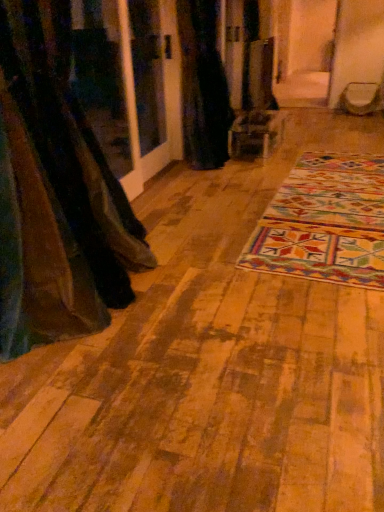
Question: Does multicolored woven mat at center have a lesser height compared to brown fabric curtain at left, the 1th curtain viewed from the front?

Choices:
 (A) yes
 (B) no

Answer: (A)

Question: Is brown fabric curtain at left, the 1th curtain viewed from the front, inside multicolored woven mat at center?

Choices:
 (A) yes
 (B) no

Answer: (B)

Question: Would you say multicolored woven mat at center is a long distance from brown fabric curtain at left, acting as the first curtain starting from the bottom?

Choices:
 (A) yes
 (B) no

Answer: (A)

Question: Is the depth of multicolored woven mat at center greater than that of brown fabric curtain at left, which is counted as the 1th curtain, starting from the left?

Choices:
 (A) yes
 (B) no

Answer: (A)

Question: Would you say multicolored woven mat at center is outside brown fabric curtain at left, which is counted as the 1th curtain, starting from the left?

Choices:
 (A) yes
 (B) no

Answer: (A)

Question: Is multicolored woven mat at center situated inside brown fabric curtain at left, which appears as the second curtain when viewed from the right, or outside?

Choices:
 (A) outside
 (B) inside

Answer: (A)

Question: Based on their sizes in the image, would you say multicolored woven mat at center is bigger or smaller than brown fabric curtain at left, acting as the second curtain starting from the back?

Choices:
 (A) big
 (B) small

Answer: (B)

Question: Is multicolored woven mat at center in front of or behind brown fabric curtain at left, which is counted as the 1th curtain, starting from the left, in the image?

Choices:
 (A) front
 (B) behind

Answer: (B)

Question: In terms of height, does multicolored woven mat at center look taller or shorter compared to brown fabric curtain at left, the 1th curtain viewed from the front?

Choices:
 (A) tall
 (B) short

Answer: (B)

Question: From their relative heights in the image, would you say brown fabric curtain at left, which is counted as the 1th curtain, starting from the left, is taller or shorter than multicolored woven mat at center?

Choices:
 (A) tall
 (B) short

Answer: (A)

Question: Is brown fabric curtain at left, acting as the second curtain starting from the back, spatially inside multicolored woven mat at center, or outside of it?

Choices:
 (A) inside
 (B) outside

Answer: (B)

Question: Is point (94, 273) positioned closer to the camera than point (274, 224)?

Choices:
 (A) closer
 (B) farther

Answer: (A)

Question: Considering their positions, is brown fabric curtain at left, the 1th curtain viewed from the front, located in front of or behind multicolored woven mat at center?

Choices:
 (A) front
 (B) behind

Answer: (A)

Question: In terms of height, does black fabric curtain at center, which appears as the 2th curtain when ordered from the bottom, look taller or shorter compared to multicolored woven mat at center?

Choices:
 (A) short
 (B) tall

Answer: (B)

Question: In terms of size, does black fabric curtain at center, which appears as the 2th curtain when ordered from the bottom, appear bigger or smaller than multicolored woven mat at center?

Choices:
 (A) small
 (B) big

Answer: (B)